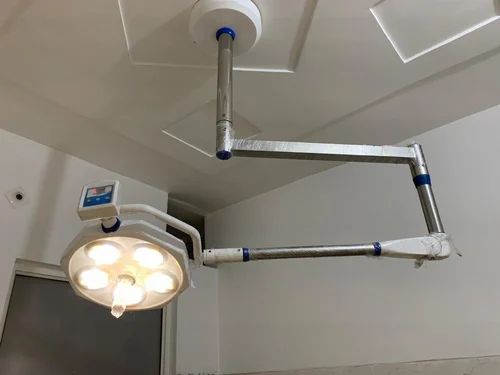
Where is `squares on ceiling`? squares on ceiling is located at coordinates (194, 130), (159, 34), (411, 26).